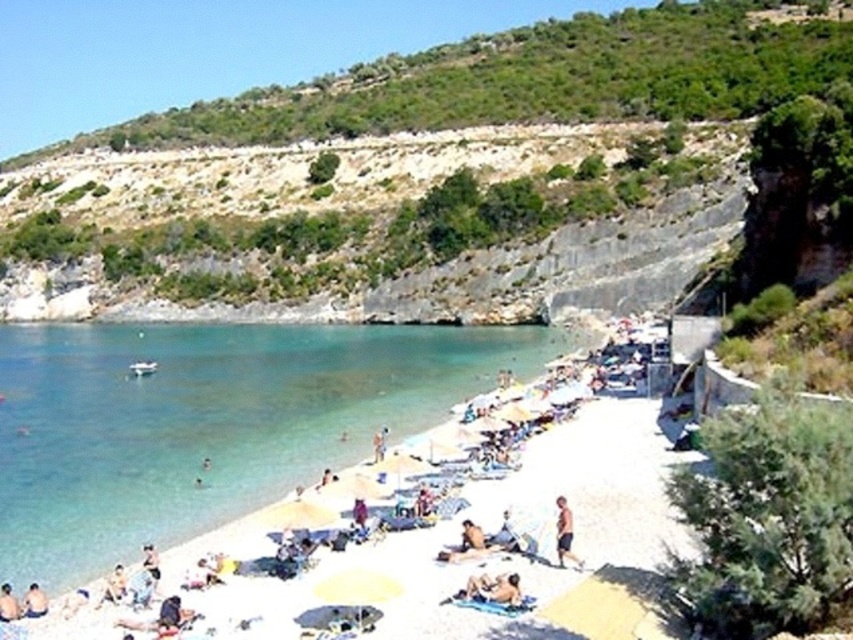
Which is more to the left, tan skin person at lower center or light brown skin at lower left?

light brown skin at lower left

Is tan skin person at lower center taller than light brown skin at lower left?

No.

Image resolution: width=853 pixels, height=640 pixels. What do you see at coordinates (494, 588) in the screenshot?
I see `tan skin person at lower center` at bounding box center [494, 588].

The height and width of the screenshot is (640, 853). I want to click on tan skin person at lower center, so click(x=494, y=588).

Which of these two, clear water at beach left or green leafy hillside at upper center, stands shorter?

With less height is clear water at beach left.

Is clear water at beach left closer to the viewer compared to green leafy hillside at upper center?

Yes, it is in front of green leafy hillside at upper center.

You are a GUI agent. You are given a task and a screenshot of the screen. Output one action in this format:
    pyautogui.click(x=<x>, y=<y>)
    Task: Click on the clear water at beach left
    The height and width of the screenshot is (640, 853).
    Given the screenshot: What is the action you would take?
    pyautogui.click(x=207, y=422)

Who is positioned more to the left, clear water at beach left or light brown skin at lower left?

clear water at beach left

Consider the image. Between clear water at beach left and light brown skin at lower left, which one has more height?

Standing taller between the two is clear water at beach left.

Where is `clear water at beach left`? The width and height of the screenshot is (853, 640). clear water at beach left is located at coordinates (207, 422).

Find the location of a particular element. Image resolution: width=853 pixels, height=640 pixels. clear water at beach left is located at coordinates (207, 422).